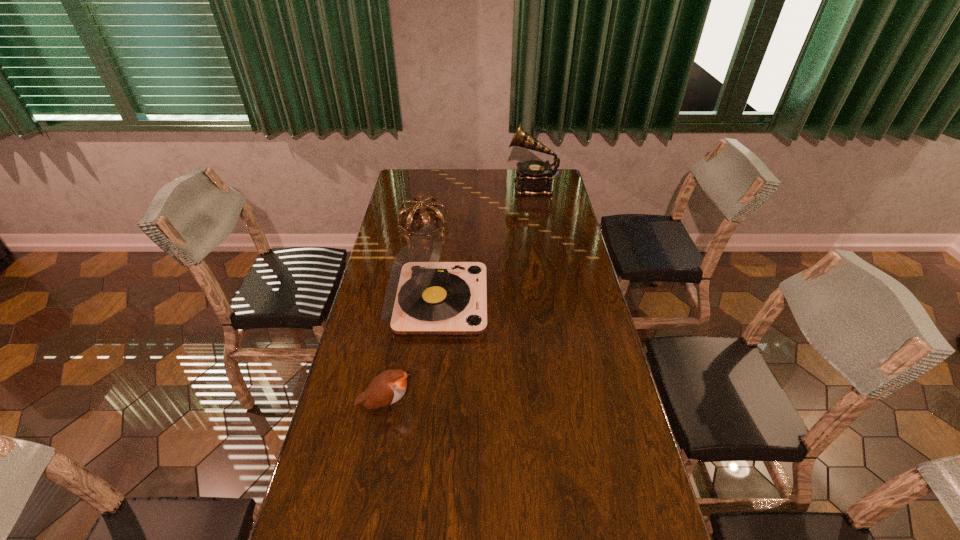
This screenshot has height=540, width=960. I want to click on the farthest object, so click(534, 178).

This screenshot has width=960, height=540. I want to click on phonograph record, so click(534, 178).

I want to click on the second nearest object, so click(423, 296).

You are a GUI agent. You are given a task and a screenshot of the screen. Output one action in this format:
    pyautogui.click(x=<x>, y=<y>)
    Task: Click on the bird
    This screenshot has width=960, height=540.
    Given the screenshot: What is the action you would take?
    pyautogui.click(x=387, y=388)

I want to click on tiara, so click(x=417, y=205).

You are a GUI agent. You are given a task and a screenshot of the screen. Output one action in this format:
    pyautogui.click(x=<x>, y=<y>)
    Task: Click on the vacant space located on the horn of the rightmost object
    This screenshot has width=960, height=540.
    Given the screenshot: What is the action you would take?
    pyautogui.click(x=434, y=186)

At what (x,y) coordinates should I click in order to perform the action: click on free location located on the horn of the rightmost object. Please return your answer as a coordinate pair (x, y). This screenshot has width=960, height=540. Looking at the image, I should click on (429, 186).

In order to click on vacant space situated 0.130m on the horn of the rightmost object in this screenshot , I will do `click(481, 186)`.

Locate an element on the screen. free space located 0.180m with the tonearm facing the front of the record player is located at coordinates (538, 302).

Where is `vacant space positioned 0.100m at the face of the nearest object`? The image size is (960, 540). vacant space positioned 0.100m at the face of the nearest object is located at coordinates (452, 404).